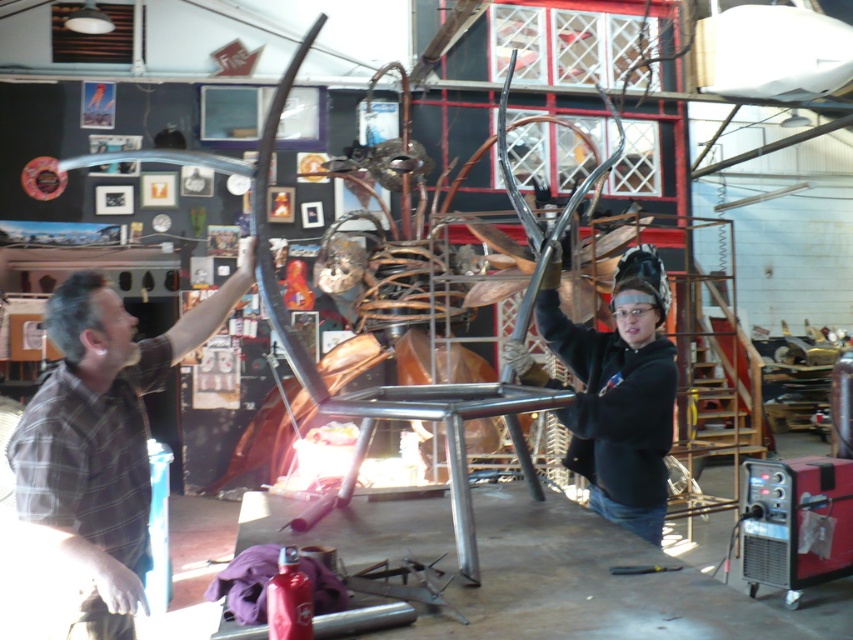
Question: Is the position of brown plaid shirt at left more distant than that of black matte welding helmet at upper center?

Choices:
 (A) no
 (B) yes

Answer: (A)

Question: Is brown plaid shirt at left thinner than black matte welding helmet at upper center?

Choices:
 (A) no
 (B) yes

Answer: (A)

Question: Which of the following is the farthest from the observer?

Choices:
 (A) black matte welding helmet at upper center
 (B) brown plaid shirt at left

Answer: (A)

Question: Does brown plaid shirt at left appear under black matte welding helmet at upper center?

Choices:
 (A) yes
 (B) no

Answer: (A)

Question: Which point is closer to the camera taking this photo?

Choices:
 (A) (636, 349)
 (B) (48, 435)

Answer: (B)